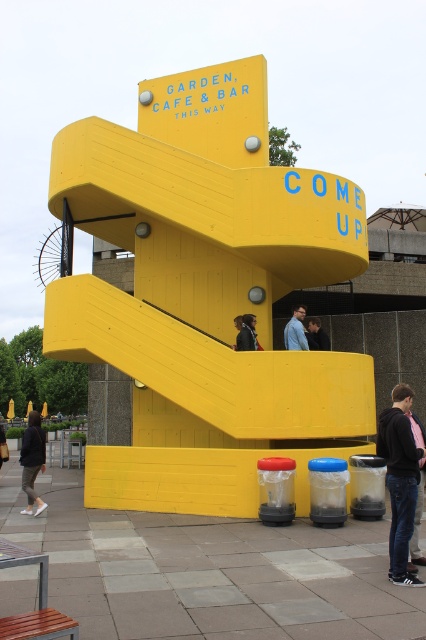
Question: Observing the image, what is the correct spatial positioning of dark gray hoodie at lower left in reference to blue fabric shirt at center?

Choices:
 (A) left
 (B) right

Answer: (A)

Question: Among these objects, which one is nearest to the camera?

Choices:
 (A) dark blue shirt at center
 (B) blue fabric shirt at center
 (C) yellow wood slide at center
 (D) dark brown leather jacket at center

Answer: (C)

Question: From the image, what is the correct spatial relationship of dark blue jeans at lower right in relation to dark brown leather jacket at lower left?

Choices:
 (A) left
 (B) right

Answer: (B)

Question: Which object is closer to the camera taking this photo?

Choices:
 (A) dark brown leather jacket at center
 (B) dark brown leather jacket at lower left
 (C) dark gray hoodie at lower left

Answer: (C)

Question: Which is farther from the dark brown leather jacket at center?

Choices:
 (A) pink fabric jacket at lower right
 (B) dark brown leather jacket at lower left

Answer: (A)

Question: Is dark blue jeans at lower right above dark blue jacket at center?

Choices:
 (A) yes
 (B) no

Answer: (B)